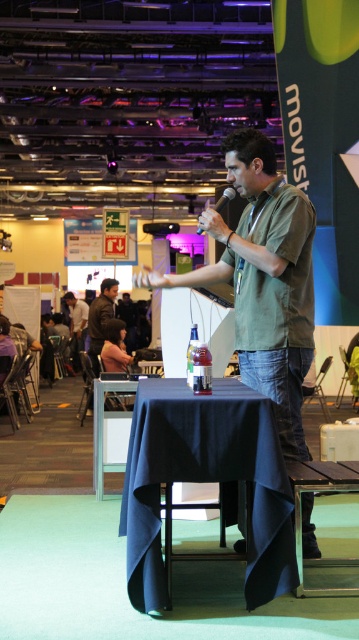
Question: Can you confirm if dark blue fabric-covered table at center is positioned to the right of green matte shirt at center?

Choices:
 (A) no
 (B) yes

Answer: (A)

Question: Which object appears closest to the camera in this image?

Choices:
 (A) green matte shirt at center
 (B) white glossy table at center
 (C) matte black microphone at upper center

Answer: (A)

Question: Which point is farther from the camera taking this photo?

Choices:
 (A) (221, 193)
 (B) (319, 564)
 (C) (75, 312)
 (D) (272, 353)

Answer: (C)

Question: Which object is farther from the camera taking this photo?

Choices:
 (A) dark blue fabric-covered table at center
 (B) matte black microphone at upper center
 (C) green matte shirt at center

Answer: (B)

Question: Is dark blue fabric-covered table at center thinner than matte black shirt at center?

Choices:
 (A) no
 (B) yes

Answer: (A)

Question: Is dark blue fabric-covered table at center positioned before metallic silver table at center?

Choices:
 (A) yes
 (B) no

Answer: (A)